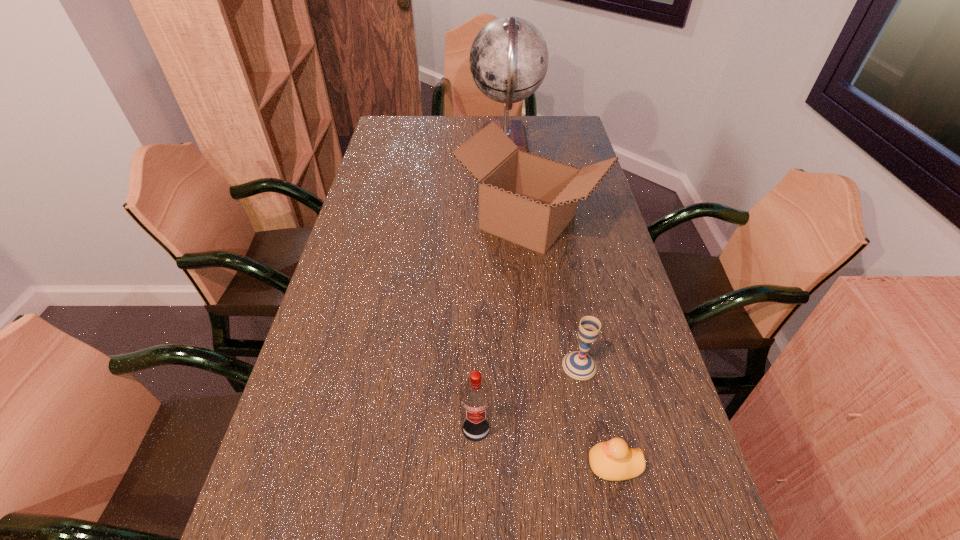
You are a GUI agent. You are given a task and a screenshot of the screen. Output one action in this format:
    pyautogui.click(x=<x>, y=<y>)
    Task: Click on the free space located 0.380m at the equator of the tallest object
    
    Given the screenshot: What is the action you would take?
    pyautogui.click(x=375, y=143)

Locate an element on the screen. The height and width of the screenshot is (540, 960). blank space located at the equator of the tallest object is located at coordinates (448, 143).

What are the coordinates of `vacant space located at the equator of the tallest object` in the screenshot? It's located at (430, 143).

The image size is (960, 540). In order to click on vacant space situated 0.120m on the front of the fourth shortest object in this screenshot , I will do `click(538, 298)`.

Locate an element on the screen. free space located 0.060m on the front label of the vodka is located at coordinates (476, 474).

Image resolution: width=960 pixels, height=540 pixels. I want to click on free space located 0.250m on the front of the third nearest object, so (604, 497).

At what (x,y) coordinates should I click in order to perform the action: click on vacant space situated on the face of the shortest object. Please return your answer as a coordinate pair (x, y). This screenshot has height=540, width=960. Looking at the image, I should click on (521, 465).

Where is `vacant space located on the face of the shortest object`? The height and width of the screenshot is (540, 960). vacant space located on the face of the shortest object is located at coordinates (537, 465).

The width and height of the screenshot is (960, 540). I want to click on vacant space located on the face of the shortest object, so click(511, 465).

Where is `object present at the far edge`? The image size is (960, 540). object present at the far edge is located at coordinates (508, 60).